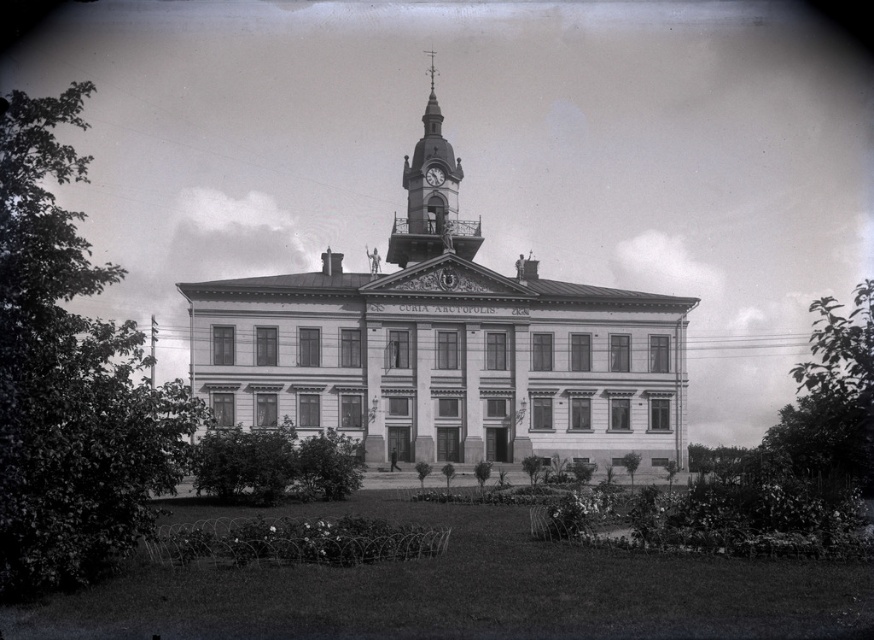
Is smooth metal clock tower at center positioned at the back of metallic clock at center?

No, smooth metal clock tower at center is in front of metallic clock at center.

Which is in front, point (437, 236) or point (435, 177)?

Point (437, 236)

This screenshot has width=874, height=640. Identify the location of smooth metal clock tower at center. (431, 198).